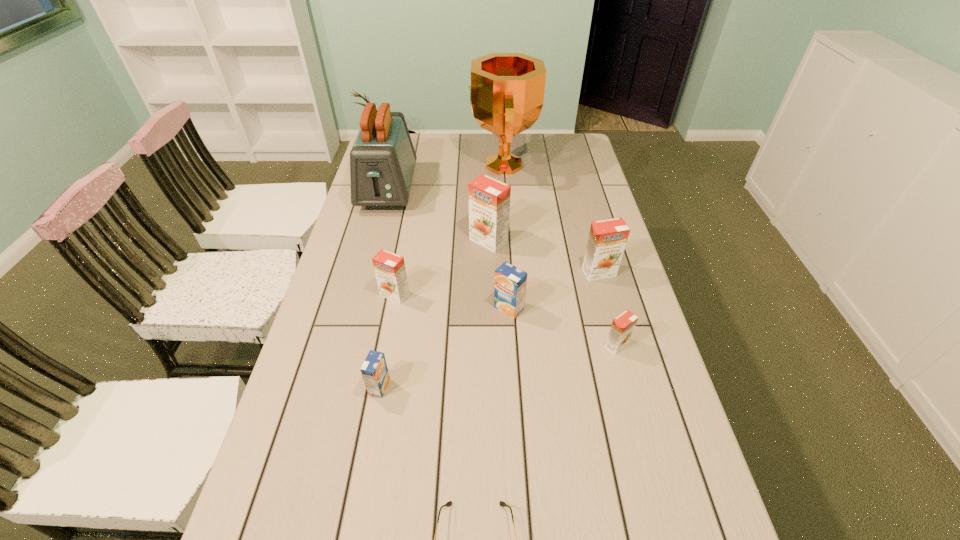
Locate an element on the screen. vacant region at the right edge of the desktop is located at coordinates (575, 198).

Identify the location of vacant point located between the third smallest orange orange juice and the bigger blue orange_juice. (554, 291).

Locate an element on the screen. The image size is (960, 540). free space between the right blue orange_juice and the fifth farthest orange juice is located at coordinates (563, 327).

Identify the location of free point between the second biggest orange orange juice and the award. The image size is (960, 540). coord(551,219).

Locate an element on the screen. empty space that is in between the gold award and the toaster is located at coordinates (445, 178).

Image resolution: width=960 pixels, height=540 pixels. What are the coordinates of `unoccupied area between the bigger blue orange_juice and the nearest orange orange juice` in the screenshot? It's located at (563, 327).

Where is `vacant space in between the award and the fourth tallest object`? This screenshot has height=540, width=960. vacant space in between the award and the fourth tallest object is located at coordinates (551, 219).

This screenshot has height=540, width=960. In order to click on object that is the third closest to the farther blue orange_juice in this screenshot , I will do `click(622, 327)`.

Select which object appears as the sixth closest to the sunglasses. Please provide its 2D coordinates. Your answer should be formatted as a tuple, i.e. [(x, y)], where the tuple contains the x and y coordinates of a point satisfying the conditions above.

[(489, 199)]

The image size is (960, 540). Identify the location of orange juice object that ranks as the fifth closest to the nearest orange orange juice. (374, 370).